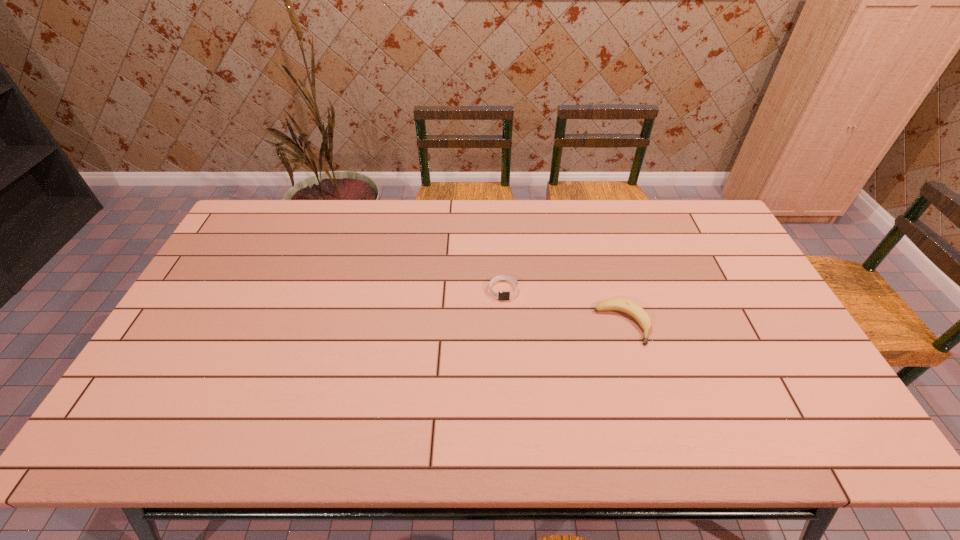
In order to click on vacant space that satisfies the following two spatial constraints: 1. on the outer surface of the farther object; 2. on the right side of the nearer object in this screenshot , I will do `click(505, 325)`.

The width and height of the screenshot is (960, 540). Find the location of `vacant space that satisfies the following two spatial constraints: 1. on the outer surface of the left object; 2. on the left side of the nearer object`. vacant space that satisfies the following two spatial constraints: 1. on the outer surface of the left object; 2. on the left side of the nearer object is located at coordinates (505, 325).

Where is `free spot that satisfies the following two spatial constraints: 1. on the outer surface of the shorter object; 2. on the right side of the right object`? The height and width of the screenshot is (540, 960). free spot that satisfies the following two spatial constraints: 1. on the outer surface of the shorter object; 2. on the right side of the right object is located at coordinates (505, 325).

Where is `vacant space that satisfies the following two spatial constraints: 1. on the outer surface of the farther object; 2. on the right side of the taller object`? The width and height of the screenshot is (960, 540). vacant space that satisfies the following two spatial constraints: 1. on the outer surface of the farther object; 2. on the right side of the taller object is located at coordinates (505, 325).